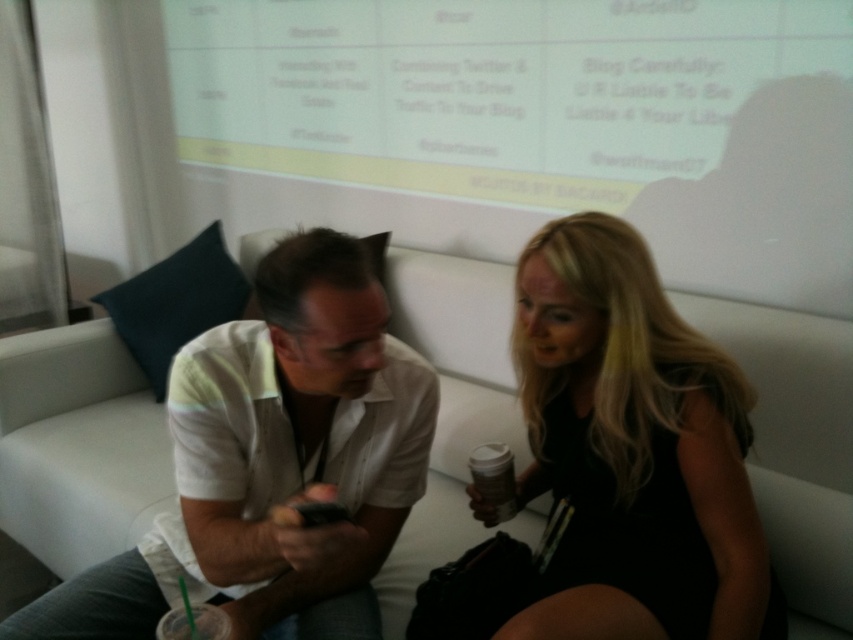
You are designing a new seating arrangement for a small conference room. The room has a couch where two people are sitting. The man is wearing a white cotton shirt at center, and the woman is wearing a black matte dress at center. The couch is 1.5 meters wide. Can both individuals sit side by side on the couch without overlapping, considering the width of their clothing?

The white cotton shirt at center is wider than the black matte dress at center. However, the combined width of both garments is not provided. Since the couch is 1.5 meters wide, it depends on the total width of their clothing. Without specific measurements, we cannot confirm if they can sit side by side without overlapping.

You are a photographer setting up a shoot in the scene described. You need to ensure that both the white cotton shirt at center and the black matte dress at center are clearly visible in the frame. Given their height difference, which clothing item might require adjustment to ensure proper visibility?

The white cotton shirt at center has a lesser height compared to the black matte dress at center. To ensure proper visibility, the white cotton shirt at center may need to be raised or the dress lowered slightly to balance their positions in the frame.

You are organizing a small event and need to place a 18cm wide decorative plate between the black matte dress at center and the white matte cup at lower center. Based on their sizes, will the plate fit between them without overlapping?

The black matte dress at center is wider than the white matte cup at lower center. Since the plate is 18cm wide, it depends on the actual space between them. However, since the dress is wider, there might be enough space. But without exact measurements of the gap, we can only assume it might fit. However, according to the given information, we can only confirm the relative sizes, not the distance between them. Therefore, the answer cannot be definitively determined with the provided data.